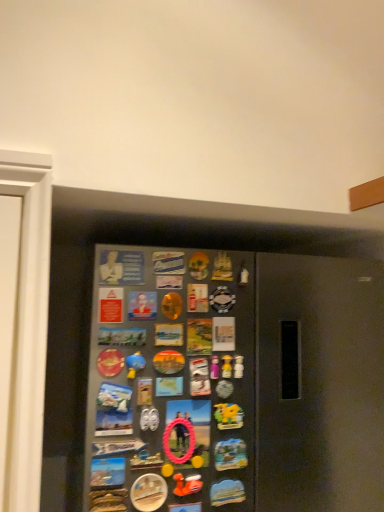
Question: Is the depth of matte plastic bust at upper center, marked as the 1th button in a top-to-bottom arrangement, greater than that of pink rubber ring at center, positioned as the 4th button in bottom-to-top order?

Choices:
 (A) no
 (B) yes

Answer: (B)

Question: From the image's perspective, would you say matte plastic bust at upper center, marked as the 1th button in a top-to-bottom arrangement, is positioned over pink rubber ring at center, positioned as the 4th button in bottom-to-top order?

Choices:
 (A) yes
 (B) no

Answer: (A)

Question: Does matte plastic bust at upper center, positioned as the 6th button in bottom-to-top order, have a lesser width compared to pink rubber ring at center, marked as the 3th button in a top-to-bottom arrangement?

Choices:
 (A) yes
 (B) no

Answer: (A)

Question: Does matte plastic bust at upper center, positioned as the 6th button in bottom-to-top order, have a greater height compared to pink rubber ring at center, marked as the 3th button in a top-to-bottom arrangement?

Choices:
 (A) no
 (B) yes

Answer: (A)

Question: Can you confirm if matte plastic bust at upper center, marked as the 1th button in a top-to-bottom arrangement, is positioned to the left of pink rubber ring at center, marked as the 3th button in a top-to-bottom arrangement?

Choices:
 (A) no
 (B) yes

Answer: (B)

Question: Is matte plastic bust at upper center, marked as the 1th button in a top-to-bottom arrangement, oriented away from pink rubber ring at center, marked as the 3th button in a top-to-bottom arrangement?

Choices:
 (A) no
 (B) yes

Answer: (A)

Question: Does metallic silver button at lower center, which appears as the sixth button when viewed from the top, have a larger size compared to metallic button at center, the 5th button when ordered from bottom to top?

Choices:
 (A) yes
 (B) no

Answer: (A)

Question: From the image's perspective, is metallic silver button at lower center, which appears as the sixth button when viewed from the top, located beneath metallic button at center, acting as the 2th button starting from the top?

Choices:
 (A) yes
 (B) no

Answer: (A)

Question: From a real-world perspective, is metallic silver button at lower center, which ranks as the 1th button in bottom-to-top order, over metallic button at center, acting as the 2th button starting from the top?

Choices:
 (A) yes
 (B) no

Answer: (B)

Question: Considering the relative sizes of metallic silver button at lower center, which ranks as the 1th button in bottom-to-top order, and metallic button at center, acting as the 2th button starting from the top, in the image provided, is metallic silver button at lower center, which ranks as the 1th button in bottom-to-top order, taller than metallic button at center, acting as the 2th button starting from the top,?

Choices:
 (A) yes
 (B) no

Answer: (A)

Question: Considering the relative sizes of metallic silver button at lower center, which ranks as the 1th button in bottom-to-top order, and metallic button at center, the 5th button when ordered from bottom to top, in the image provided, is metallic silver button at lower center, which ranks as the 1th button in bottom-to-top order, thinner than metallic button at center, the 5th button when ordered from bottom to top,?

Choices:
 (A) no
 (B) yes

Answer: (A)

Question: Would you consider metallic silver button at lower center, which ranks as the 1th button in bottom-to-top order, to be distant from metallic button at center, acting as the 2th button starting from the top?

Choices:
 (A) yes
 (B) no

Answer: (B)

Question: Is the depth of rubber duck at center greater than that of matte plastic bust at upper center, positioned as the 6th button in bottom-to-top order?

Choices:
 (A) no
 (B) yes

Answer: (B)